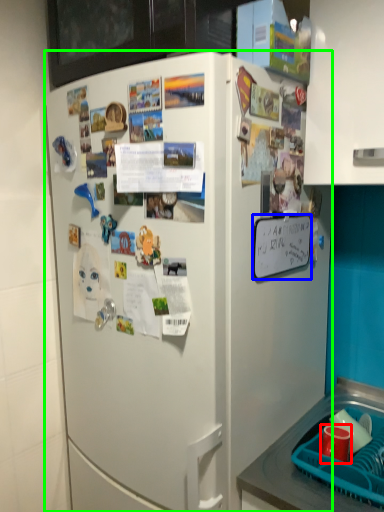
Question: Based on their relative distances, which object is nearer to coffee cup (highlighted by a red box)? Choose from poster (highlighted by a blue box) and refrigerator (highlighted by a green box).

Choices:
 (A) poster
 (B) refrigerator

Answer: (A)